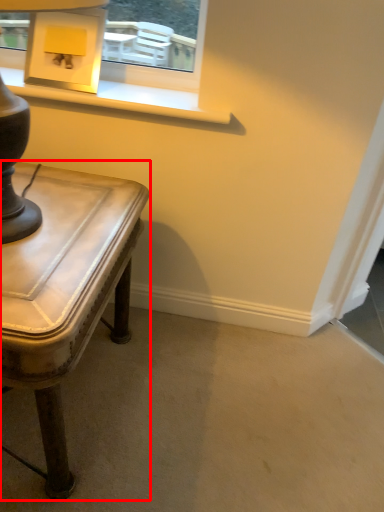
Question: Considering the relative positions of table (annotated by the red box) and table lamp in the image provided, where is table (annotated by the red box) located with respect to the staircase?

Choices:
 (A) right
 (B) left

Answer: (B)